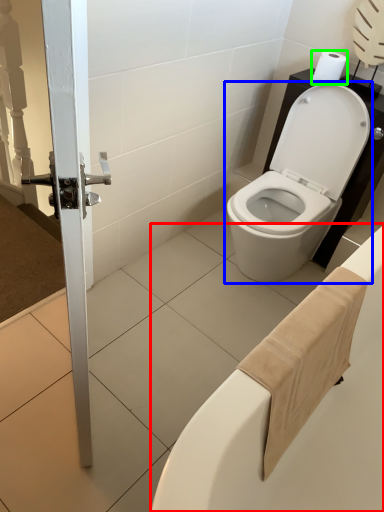
Question: Which object is the farthest from bath (highlighted by a red box)? Choose among these: toilet (highlighted by a blue box) or toilet paper (highlighted by a green box).

Choices:
 (A) toilet
 (B) toilet paper

Answer: (B)